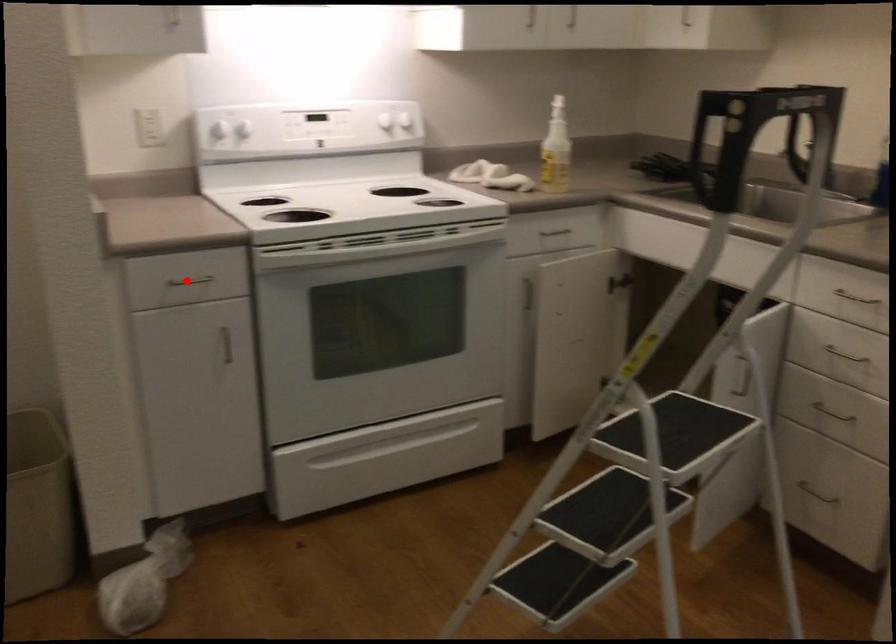
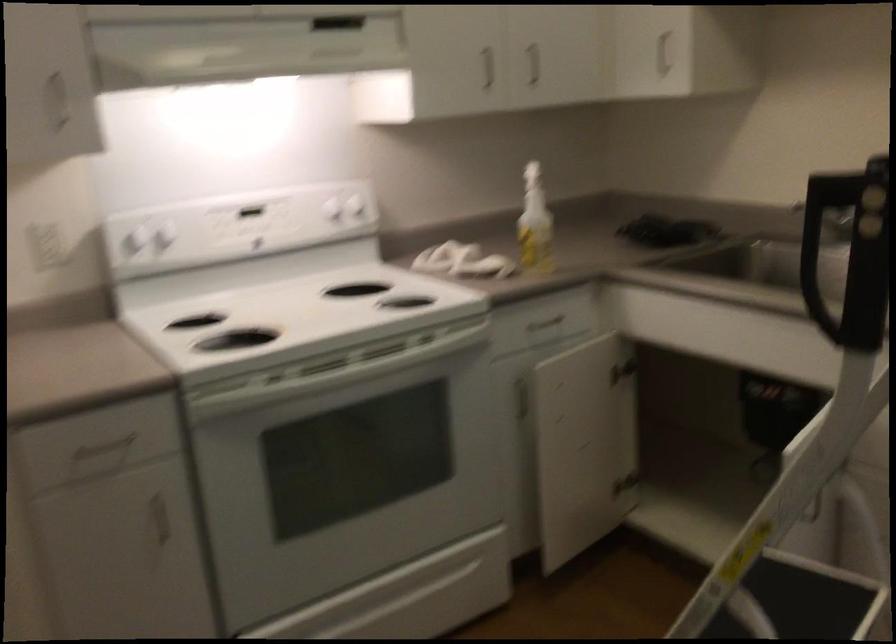
Question: I am providing you with two images of the same scene from different viewpoints. In image1, a red point is highlighted. Considering the same 3D point in image2, which of the following is correct?

Choices:
 (A) It is closer
 (B) It is farther

Answer: (A)